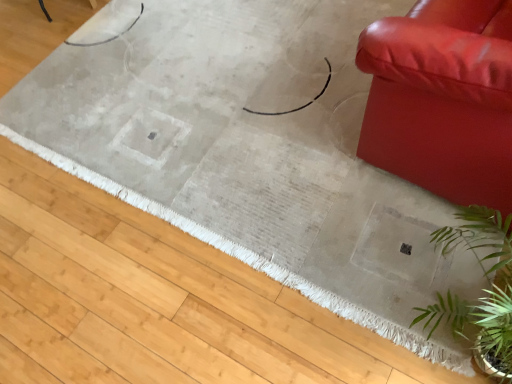
This screenshot has height=384, width=512. I want to click on free space to the left of shiny leather couch at right, so click(x=271, y=144).